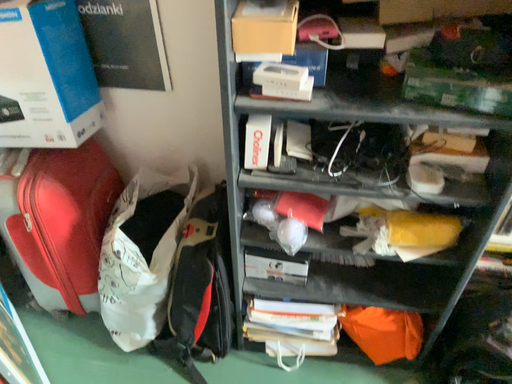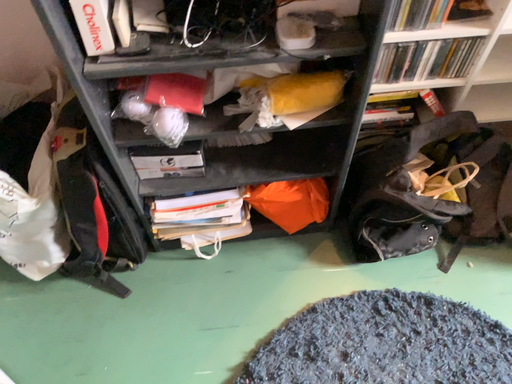
Question: Which way did the camera rotate in the video?

Choices:
 (A) rotated downward
 (B) rotated upward

Answer: (A)